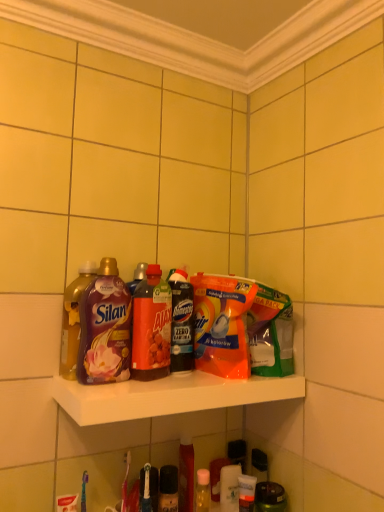
This screenshot has width=384, height=512. What do you see at coordinates (168, 396) in the screenshot? I see `white glossy shelf at center` at bounding box center [168, 396].

Describe the element at coordinates (222, 324) in the screenshot. I see `orange plastic dishwashing liquid at center` at that location.

I want to click on shiny purple bottle at left, acting as the 1th bottle starting from the left, so click(73, 320).

Locate an element on the screen. translucent orange bottle at center, the 2th bottle when ordered from right to left is located at coordinates click(151, 327).

Considering the positions of points (135, 334) and (122, 309), is point (135, 334) closer to camera compared to point (122, 309)?

That is False.

Do you think translucent orange bottle at center, the 2th bottle when ordered from right to left, is within matte plastic bottle at left, arranged as the 2th bottle when viewed from the left, or outside of it?

translucent orange bottle at center, the 2th bottle when ordered from right to left, cannot be found inside matte plastic bottle at left, arranged as the 2th bottle when viewed from the left.

Who is more distant, translucent orange bottle at center, the 2th bottle when ordered from right to left, or matte plastic bottle at left, arranged as the 2th bottle when viewed from the left?

translucent orange bottle at center, the 2th bottle when ordered from right to left, is further from the camera.

Is translucent orange bottle at center, the 2th bottle when ordered from right to left, thinner than matte plastic bottle at left, the third bottle in the right-to-left sequence?

In fact, translucent orange bottle at center, the 2th bottle when ordered from right to left, might be wider than matte plastic bottle at left, the third bottle in the right-to-left sequence.

How far apart are matte plastic bottle at left, the third bottle in the right-to-left sequence, and shiny purple bottle at left, acting as the 1th bottle starting from the left?

matte plastic bottle at left, the third bottle in the right-to-left sequence, is 2.77 inches away from shiny purple bottle at left, acting as the 1th bottle starting from the left.

There is a shiny purple bottle at left, acting as the 1th bottle starting from the left. Where is `the 3rd bottle above it (from a real-world perspective)`? the 3rd bottle above it (from a real-world perspective) is located at coordinates (105, 328).

Consider the image. Which of these two, matte plastic bottle at left, the third bottle in the right-to-left sequence, or shiny purple bottle at left, acting as the 1th bottle starting from the left, is wider?

shiny purple bottle at left, acting as the 1th bottle starting from the left.

Can you tell me how much matte plastic bottle at left, arranged as the 2th bottle when viewed from the left, and shiny purple bottle at left, marked as the fourth bottle in a right-to-left arrangement, differ in facing direction?

2.7e-05 degrees.

Does white glossy shelf at center have a greater width compared to translucent plastic bottle at center, which is the fourth bottle from left to right?

Indeed, white glossy shelf at center has a greater width compared to translucent plastic bottle at center, which is the fourth bottle from left to right.

Is white glossy shelf at center not close to translucent plastic bottle at center, which is the fourth bottle from left to right?

No, white glossy shelf at center is in close proximity to translucent plastic bottle at center, which is the fourth bottle from left to right.

From a real-world perspective, is white glossy shelf at center beneath translucent plastic bottle at center, which is the fourth bottle from left to right?

Yes, from a real-world perspective, white glossy shelf at center is below translucent plastic bottle at center, which is the fourth bottle from left to right.

In the scene shown: Can you confirm if translucent orange bottle at center, the 2th bottle when ordered from right to left, is wider than translucent plastic bottle at center, which is the first bottle in right-to-left order?

Correct, the width of translucent orange bottle at center, the 2th bottle when ordered from right to left, exceeds that of translucent plastic bottle at center, which is the first bottle in right-to-left order.

Does translucent orange bottle at center, arranged as the third bottle when viewed from the left, touch translucent plastic bottle at center, which is the first bottle in right-to-left order?

Yes, translucent orange bottle at center, arranged as the third bottle when viewed from the left, is in contact with translucent plastic bottle at center, which is the first bottle in right-to-left order.

From a real-world perspective, is orange plastic dishwashing liquid at center positioned above or below translucent orange bottle at center, the 2th bottle when ordered from right to left?

orange plastic dishwashing liquid at center is below translucent orange bottle at center, the 2th bottle when ordered from right to left.

Is orange plastic dishwashing liquid at center not close to translucent orange bottle at center, the 2th bottle when ordered from right to left?

No, orange plastic dishwashing liquid at center is in close proximity to translucent orange bottle at center, the 2th bottle when ordered from right to left.

Is orange plastic dishwashing liquid at center facing towards translucent orange bottle at center, arranged as the third bottle when viewed from the left?

No, orange plastic dishwashing liquid at center does not turn towards translucent orange bottle at center, arranged as the third bottle when viewed from the left.

Is orange plastic dishwashing liquid at center inside the boundaries of translucent orange bottle at center, the 2th bottle when ordered from right to left, or outside?

orange plastic dishwashing liquid at center is not enclosed by translucent orange bottle at center, the 2th bottle when ordered from right to left.

In the scene shown: Who is smaller, translucent orange bottle at center, the 2th bottle when ordered from right to left, or orange plastic dishwashing liquid at center?

With smaller size is translucent orange bottle at center, the 2th bottle when ordered from right to left.

Are translucent orange bottle at center, the 2th bottle when ordered from right to left, and orange plastic dishwashing liquid at center making contact?

No, translucent orange bottle at center, the 2th bottle when ordered from right to left, is not making contact with orange plastic dishwashing liquid at center.

Does translucent orange bottle at center, the 2th bottle when ordered from right to left, contain orange plastic dishwashing liquid at center?

No, orange plastic dishwashing liquid at center is not surrounded by translucent orange bottle at center, the 2th bottle when ordered from right to left.

How different are the orientations of translucent plastic bottle at center, which is the first bottle in right-to-left order, and translucent orange bottle at center, arranged as the third bottle when viewed from the left, in degrees?

There is a 0.000105-degree angle between the facing directions of translucent plastic bottle at center, which is the first bottle in right-to-left order, and translucent orange bottle at center, arranged as the third bottle when viewed from the left.

From a real-world perspective, is translucent plastic bottle at center, which is the first bottle in right-to-left order, over translucent orange bottle at center, arranged as the third bottle when viewed from the left?

No, from a real-world perspective, translucent plastic bottle at center, which is the first bottle in right-to-left order, is not over translucent orange bottle at center, arranged as the third bottle when viewed from the left

Between translucent plastic bottle at center, which is the fourth bottle from left to right, and translucent orange bottle at center, arranged as the third bottle when viewed from the left, which one appears on the right side from the viewer's perspective?

translucent plastic bottle at center, which is the fourth bottle from left to right.

Is translucent plastic bottle at center, which is the first bottle in right-to-left order, smaller than translucent orange bottle at center, the 2th bottle when ordered from right to left?

Indeed, translucent plastic bottle at center, which is the first bottle in right-to-left order, has a smaller size compared to translucent orange bottle at center, the 2th bottle when ordered from right to left.

Identify the location of bottle above the translucent orange bottle at center, the 2th bottle when ordered from right to left (from a real-world perspective). (105, 328).

The image size is (384, 512). I want to click on the 1st bottle positioned below the matte plastic bottle at left, arranged as the 2th bottle when viewed from the left (from the image's perspective), so click(x=73, y=320).

Estimate the real-world distances between objects in this image. Which object is further from matte plastic bottle at left, the third bottle in the right-to-left sequence, orange plastic dishwashing liquid at center or white glossy shelf at center?

orange plastic dishwashing liquid at center lies further to matte plastic bottle at left, the third bottle in the right-to-left sequence, than the other object.

Which object lies nearer to the anchor point translucent orange bottle at center, the 2th bottle when ordered from right to left, orange plastic dishwashing liquid at center or translucent plastic bottle at center, which is the first bottle in right-to-left order?

translucent plastic bottle at center, which is the first bottle in right-to-left order.

Based on the photo, when comparing their distances from translucent plastic bottle at center, which is the first bottle in right-to-left order, does translucent orange bottle at center, arranged as the third bottle when viewed from the left, or orange plastic dishwashing liquid at center seem closer?

Among the two, translucent orange bottle at center, arranged as the third bottle when viewed from the left, is located nearer to translucent plastic bottle at center, which is the first bottle in right-to-left order.

Looking at the image, which one is located closer to white glossy shelf at center, matte plastic bottle at left, arranged as the 2th bottle when viewed from the left, or translucent plastic bottle at center, which is the fourth bottle from left to right?

matte plastic bottle at left, arranged as the 2th bottle when viewed from the left, is positioned closer to the anchor white glossy shelf at center.

From the image, which object appears to be farther from white glossy shelf at center, orange plastic dishwashing liquid at center or translucent orange bottle at center, the 2th bottle when ordered from right to left?

The object further to white glossy shelf at center is orange plastic dishwashing liquid at center.

Based on their spatial positions, is shiny purple bottle at left, marked as the fourth bottle in a right-to-left arrangement, or matte plastic bottle at left, arranged as the 2th bottle when viewed from the left, closer to translucent orange bottle at center, the 2th bottle when ordered from right to left?

The object closer to translucent orange bottle at center, the 2th bottle when ordered from right to left, is matte plastic bottle at left, arranged as the 2th bottle when viewed from the left.

Looking at the image, which one is located closer to shiny purple bottle at left, marked as the fourth bottle in a right-to-left arrangement, white glossy shelf at center or translucent orange bottle at center, the 2th bottle when ordered from right to left?

Based on the image, translucent orange bottle at center, the 2th bottle when ordered from right to left, appears to be nearer to shiny purple bottle at left, marked as the fourth bottle in a right-to-left arrangement.

Looking at the image, which one is located further to white glossy shelf at center, shiny purple bottle at left, acting as the 1th bottle starting from the left, or matte plastic bottle at left, arranged as the 2th bottle when viewed from the left?

Based on the image, shiny purple bottle at left, acting as the 1th bottle starting from the left, appears to be further to white glossy shelf at center.

Identify the location of bottle located between shiny purple bottle at left, marked as the fourth bottle in a right-to-left arrangement, and translucent orange bottle at center, the 2th bottle when ordered from right to left, in the left-right direction. (105, 328).

At what (x,y) coordinates should I click in order to perform the action: click on shelf situated between matte plastic bottle at left, arranged as the 2th bottle when viewed from the left, and orange plastic dishwashing liquid at center from left to right. Please return your answer as a coordinate pair (x, y). This screenshot has width=384, height=512. Looking at the image, I should click on (168, 396).

Identify the location of cleaning product located between white glossy shelf at center and translucent plastic bottle at center, which is the fourth bottle from left to right, in the depth direction. The image size is (384, 512). (222, 324).

The image size is (384, 512). In order to click on bottle between matte plastic bottle at left, the third bottle in the right-to-left sequence, and translucent plastic bottle at center, which is the first bottle in right-to-left order, from left to right in this screenshot , I will do `click(151, 327)`.